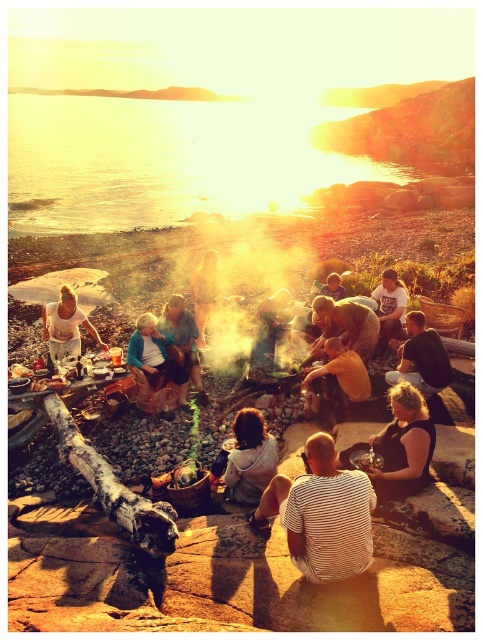
Describe the element at coordinates (422, 358) in the screenshot. The width and height of the screenshot is (483, 640). I see `dark brown leather jacket at center` at that location.

Measure the distance between dark brown leather jacket at center and camera.

They are 6.94 meters apart.

This screenshot has width=483, height=640. I want to click on dark brown leather jacket at center, so click(x=422, y=358).

Find the location of `dark brown leather jacket at center`. dark brown leather jacket at center is located at coordinates (422, 358).

Looking at this image, which is below, dark brown leather jacket at center or matte white shirt at center?

dark brown leather jacket at center is below.

Does dark brown leather jacket at center come in front of matte white shirt at center?

That is True.

Identify the location of dark brown leather jacket at center. The width and height of the screenshot is (483, 640). (422, 358).

Where is `dark brown leather jacket at center`? Image resolution: width=483 pixels, height=640 pixels. dark brown leather jacket at center is located at coordinates (422, 358).

How far apart are yellow fabric bag at center and smooth metallic pot at center?

yellow fabric bag at center and smooth metallic pot at center are 4.41 feet apart.

Is yellow fabric bag at center bigger than smooth metallic pot at center?

Actually, yellow fabric bag at center might be smaller than smooth metallic pot at center.

Is point (349, 378) more distant than point (271, 317)?

No, (349, 378) is in front of (271, 317).

Identify the location of yellow fabric bag at center. (339, 374).